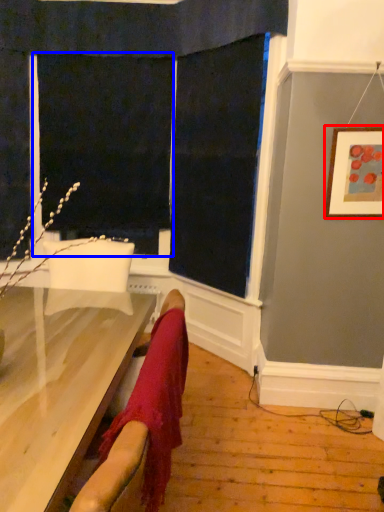
Question: Which of the following is the farthest to the observer, picture frame (highlighted by a red box) or screen door (highlighted by a blue box)?

Choices:
 (A) picture frame
 (B) screen door

Answer: (B)